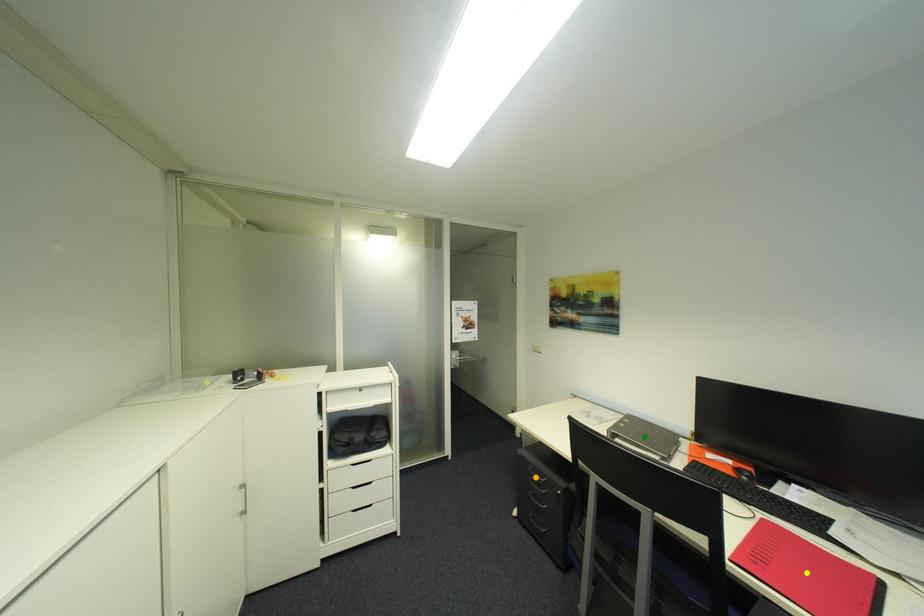
Order these from nearest to farthest:
yellow point | green point | orange point

yellow point
green point
orange point